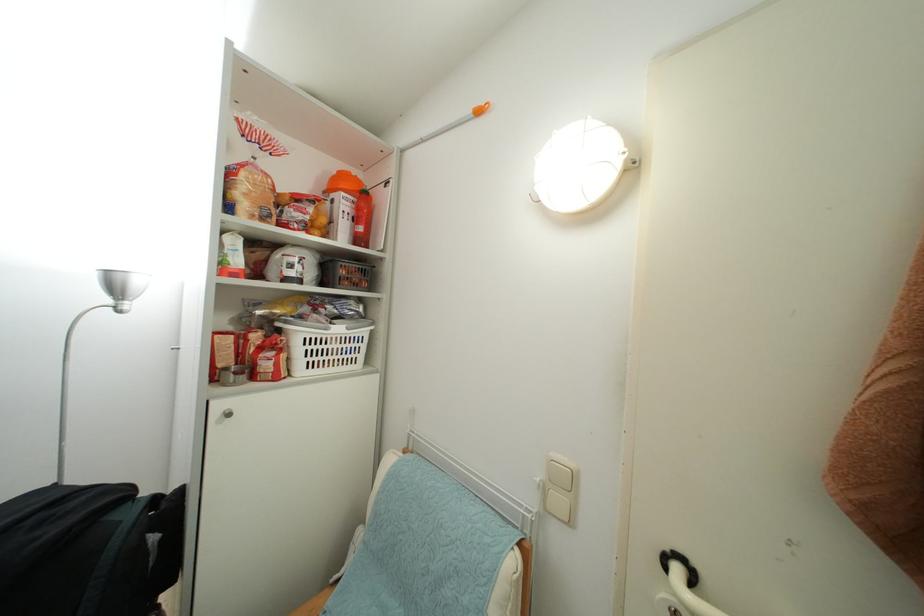
I want to click on small metal cup, so (234, 375).